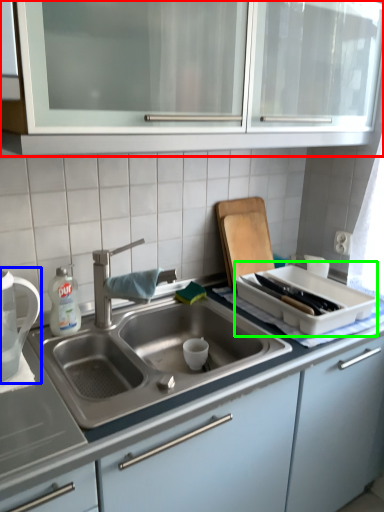
Question: Considering the real-world distances, which object is farthest from cabinetry (highlighted by a red box)? tea pot (highlighted by a blue box) or appliance (highlighted by a green box)?

Choices:
 (A) tea pot
 (B) appliance

Answer: (A)